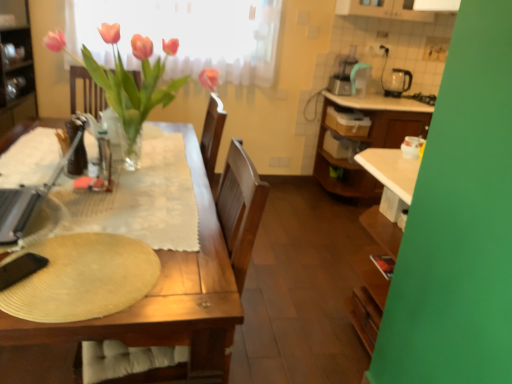
Question: From a real-world perspective, is metallic silver laptop at left, which is counted as the first appliance, starting from the front, on top of beige textured paper plate at lower left?

Choices:
 (A) yes
 (B) no

Answer: (A)

Question: Is beige textured paper plate at lower left at the back of metallic silver laptop at left, marked as the second appliance in a top-to-bottom arrangement?

Choices:
 (A) yes
 (B) no

Answer: (B)

Question: Can you confirm if metallic silver laptop at left, which is counted as the first appliance, starting from the front, is shorter than beige textured paper plate at lower left?

Choices:
 (A) no
 (B) yes

Answer: (A)

Question: Does metallic silver laptop at left, the 2th appliance when ordered from back to front, have a larger size compared to beige textured paper plate at lower left?

Choices:
 (A) no
 (B) yes

Answer: (B)

Question: From the image's perspective, is metallic silver laptop at left, the 2th appliance when ordered from back to front, under beige textured paper plate at lower left?

Choices:
 (A) no
 (B) yes

Answer: (A)

Question: Relative to metallic silver laptop at left, marked as the second appliance in a top-to-bottom arrangement, is beige textured paper plate at lower left in front or behind?

Choices:
 (A) behind
 (B) front

Answer: (B)

Question: Is beige textured paper plate at lower left to the left or to the right of metallic silver laptop at left, the 2th appliance when ordered from back to front, in the image?

Choices:
 (A) right
 (B) left

Answer: (A)

Question: Does point (79, 266) appear closer or farther from the camera than point (42, 187)?

Choices:
 (A) closer
 (B) farther

Answer: (A)

Question: Is beige textured paper plate at lower left spatially inside metallic silver laptop at left, marked as the second appliance in a top-to-bottom arrangement, or outside of it?

Choices:
 (A) outside
 (B) inside

Answer: (A)

Question: Visually, is translucent glass bottle at table left positioned to the left or to the right of metallic silver laptop at left, which is counted as the first appliance, starting from the front?

Choices:
 (A) right
 (B) left

Answer: (A)

Question: Relative to metallic silver laptop at left, which is counted as the 1th appliance, starting from the left, is translucent glass bottle at table left in front or behind?

Choices:
 (A) front
 (B) behind

Answer: (B)

Question: Is translucent glass bottle at table left bigger or smaller than metallic silver laptop at left, which is counted as the second appliance, starting from the right?

Choices:
 (A) small
 (B) big

Answer: (A)

Question: From the image's perspective, is translucent glass bottle at table left positioned above or below metallic silver laptop at left, the first appliance from the bottom?

Choices:
 (A) below
 (B) above

Answer: (B)

Question: Is point coord(133,51) positioned closer to the camera than point coord(407,89)?

Choices:
 (A) closer
 (B) farther

Answer: (A)

Question: Is translucent glass vase at center in front of or behind black plastic kettle at upper right, the first appliance positioned from the top, in the image?

Choices:
 (A) behind
 (B) front

Answer: (B)